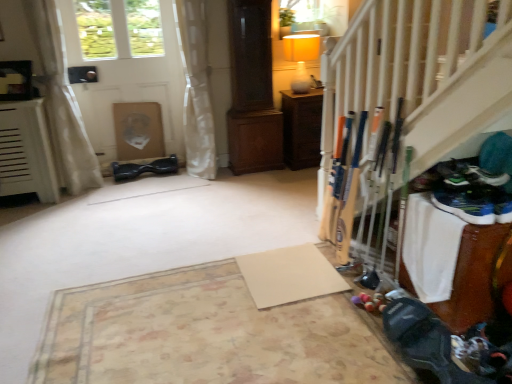
Question: In terms of width, does black rubber hoverboard at center look wider or thinner when compared to white sheer curtain at left, which is the 1th curtain from left to right?

Choices:
 (A) wide
 (B) thin

Answer: (B)

Question: Considering the positions of black rubber hoverboard at center and white sheer curtain at left, which is the 1th curtain from left to right, in the image, is black rubber hoverboard at center taller or shorter than white sheer curtain at left, which is the 1th curtain from left to right,?

Choices:
 (A) short
 (B) tall

Answer: (A)

Question: Based on their relative distances, which object is nearer to the black rubber hoverboard at center?

Choices:
 (A) white sheer curtain at left, which is the 1th curtain from left to right
 (B) white matte door at upper left
 (C) wooden cabinet at center
 (D) white sheer curtain at upper left, acting as the first curtain starting from the right
 (E) beige matte yoga mat at center, the 1th yoga mat from the right

Answer: (A)

Question: Estimate the real-world distances between objects in this image. Which object is farther from the black rubber hoverboard at center?

Choices:
 (A) white sheer curtain at left, the second curtain from the right
 (B) matte yellow glass lamp at upper center
 (C) beige matte yoga mat at center, arranged as the 1th yoga mat when viewed from the left
 (D) beige matte yoga mat at center, the 1th yoga mat from the right
 (E) white matte door at upper left

Answer: (C)